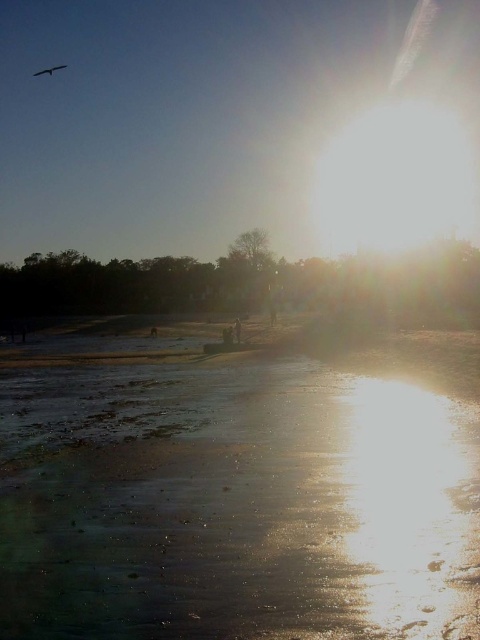
You are standing on the beach and want to take a photo of the shiny sand at lower center and the silvery metallic bird at upper left. Which object will appear larger in your camera viewfinder?

The silvery metallic bird at upper left will appear larger in the camera viewfinder because it is taller than the shiny sand at lower center.

You are standing at the beach and want to walk towards the two points marked in the image. Which point, point (x=79, y=536) or point (x=50, y=68), will you reach first?

Point (x=79, y=536) is closer to the viewer than point (x=50, y=68), so you will reach point (x=79, y=536) first.

You are a photographer trying to capture the reflection of the silvery metallic bird at upper left in the shiny sand at lower center. Based on the scene, can you confirm if the bird is positioned above the sand so its reflection would be visible?

Yes, the silvery metallic bird at upper left is above the shiny sand at lower center, so its reflection should be visible in the sand.